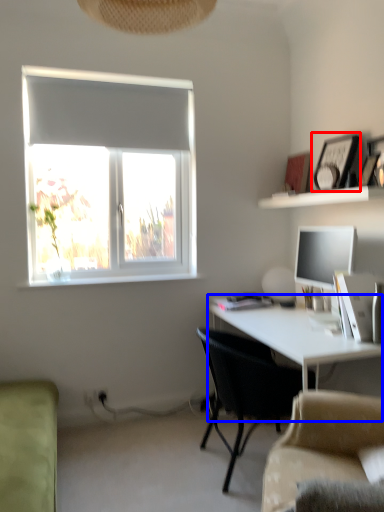
Question: Among these objects, which one is nearest to the camera, picture frame (highlighted by a red box) or desk (highlighted by a blue box)?

Choices:
 (A) picture frame
 (B) desk

Answer: (B)